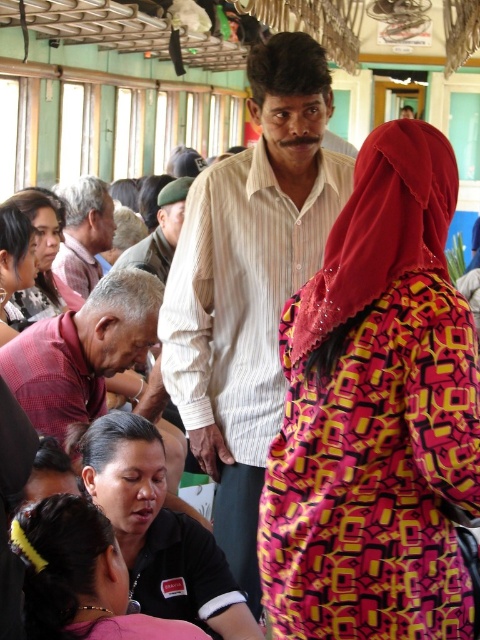
Does pink fabric at lower left appear over matte black shirt at left?

No, pink fabric at lower left is not above matte black shirt at left.

Is point (60, 554) positioned before point (32, 308)?

Yes, point (60, 554) is closer to viewer.

Is point (93, 572) in front of point (12, 324)?

Yes, point (93, 572) is closer to viewer.

Where is `pink fabric at lower left`? The height and width of the screenshot is (640, 480). pink fabric at lower left is located at coordinates (80, 577).

Consider the image. Can you confirm if matte black shirt at left is positioned above matte black hair at lower left?

Yes, matte black shirt at left is above matte black hair at lower left.

Does matte black shirt at left have a lesser width compared to matte black hair at lower left?

Incorrect, matte black shirt at left's width is not less than matte black hair at lower left's.

Locate an element on the screen. matte black shirt at left is located at coordinates (41, 262).

What are the coordinates of `matte black shirt at left` in the screenshot? It's located at (41, 262).

Is light beige striped shirt at center wider than reddish-brown checkered shirt at lower left?

In fact, light beige striped shirt at center might be narrower than reddish-brown checkered shirt at lower left.

Can you confirm if light beige striped shirt at center is thinner than reddish-brown checkered shirt at lower left?

Yes, light beige striped shirt at center is thinner than reddish-brown checkered shirt at lower left.

Between point (233, 568) and point (134, 332), which one is positioned in front?

Point (233, 568)

Locate an element on the screen. light beige striped shirt at center is located at coordinates (250, 284).